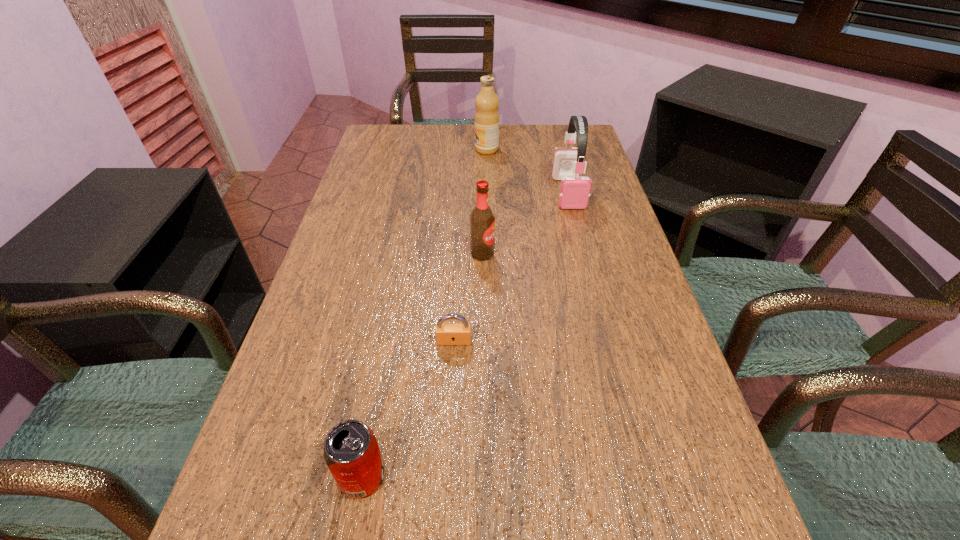
Locate an element on the screen. Image resolution: width=960 pixels, height=540 pixels. the farthest object is located at coordinates (486, 102).

At what (x,y) coordinates should I click in order to perform the action: click on the fourth nearest object. Please return your answer as a coordinate pair (x, y). Image resolution: width=960 pixels, height=540 pixels. Looking at the image, I should click on (574, 193).

At what (x,y) coordinates should I click in order to perform the action: click on earphone. Please return your answer as a coordinate pair (x, y). Looking at the image, I should click on coord(574,193).

The width and height of the screenshot is (960, 540). I want to click on the third farthest object, so click(482, 220).

Locate an element on the screen. the second shortest object is located at coordinates (351, 451).

At what (x,y) coordinates should I click in order to perform the action: click on the leftmost object. Please return your answer as a coordinate pair (x, y). Looking at the image, I should click on (351, 451).

The height and width of the screenshot is (540, 960). I want to click on padlock, so click(x=445, y=333).

Where is `the fourth farthest object`? This screenshot has height=540, width=960. the fourth farthest object is located at coordinates (445, 333).

At what (x,y) coordinates should I click in order to perform the action: click on free space located 0.120m on the label of the farthest object. Please return your answer as a coordinate pair (x, y). Looking at the image, I should click on (439, 150).

Find the location of a particular element. This screenshot has height=540, width=960. vacant space situated 0.200m on the label of the farthest object is located at coordinates (415, 150).